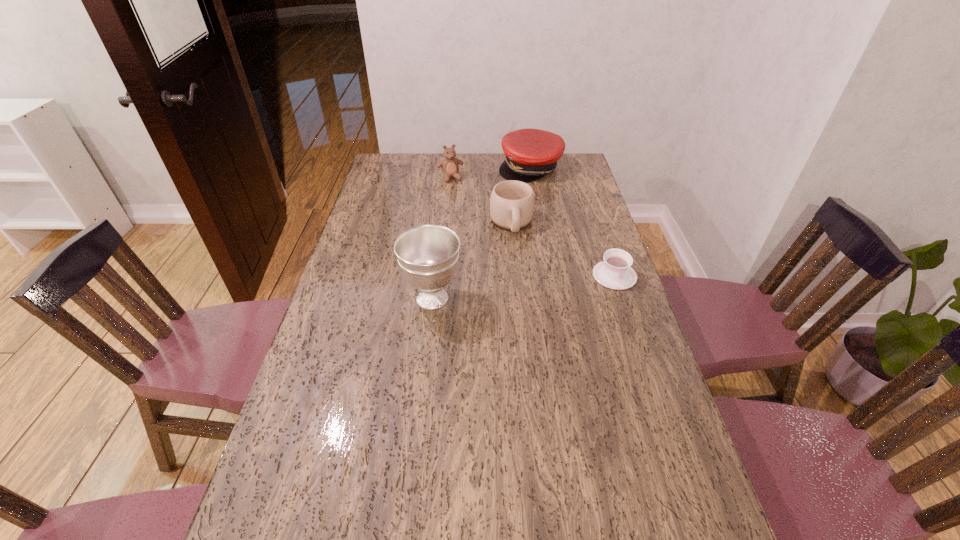
This screenshot has width=960, height=540. I want to click on cap located in the right edge section of the desktop, so click(530, 154).

What are the coordinates of `object situated at the far right corner` in the screenshot? It's located at (530, 154).

In the image, there is a desktop. At what (x,y) coordinates should I click in order to perform the action: click on blank space at the near edge. Please return your answer as a coordinate pair (x, y). Looking at the image, I should click on (348, 501).

Find the location of a particular element. The width and height of the screenshot is (960, 540). free location at the left edge of the desktop is located at coordinates (313, 482).

The height and width of the screenshot is (540, 960). Find the location of `free space at the right edge`. free space at the right edge is located at coordinates (574, 256).

Locate an element on the screen. This screenshot has width=960, height=540. free region at the far left corner is located at coordinates (384, 173).

Locate an element on the screen. This screenshot has width=960, height=540. blank space at the near right corner of the desktop is located at coordinates (666, 529).

Where is `free space between the mug and the tallest object`? This screenshot has height=540, width=960. free space between the mug and the tallest object is located at coordinates (472, 261).

Where is `free space that is in between the teddy bear and the shortest object`? free space that is in between the teddy bear and the shortest object is located at coordinates (533, 227).

Image resolution: width=960 pixels, height=540 pixels. Find the location of `free space between the teacup and the teddy bear`. free space between the teacup and the teddy bear is located at coordinates (533, 227).